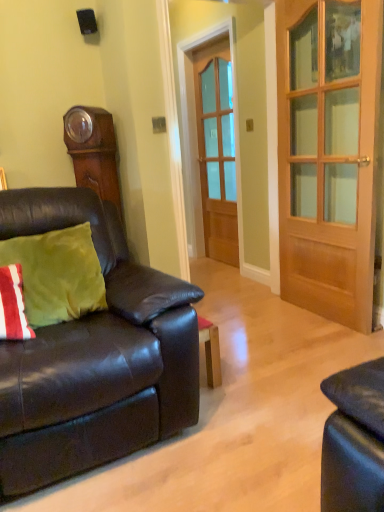
You are a GUI agent. You are given a task and a screenshot of the screen. Output one action in this format:
    pyautogui.click(x=<x>, y=<y>)
    Task: Click on the wooden grandfather clock at upper left
    
    Given the screenshot: What is the action you would take?
    pos(97,163)

Image resolution: width=384 pixels, height=512 pixels. What do you see at coordinates (97, 163) in the screenshot? I see `wooden grandfather clock at upper left` at bounding box center [97, 163].

Image resolution: width=384 pixels, height=512 pixels. Describe the element at coordinates (328, 154) in the screenshot. I see `wooden door at center, which is counted as the 2th door, starting from the left` at that location.

The image size is (384, 512). What do you see at coordinates (94, 357) in the screenshot?
I see `matte black couch at left` at bounding box center [94, 357].

This screenshot has height=512, width=384. I want to click on black matte speaker at upper center, so click(x=87, y=21).

This screenshot has height=512, width=384. Find the location of `wooden grandfather clock at upper left`. wooden grandfather clock at upper left is located at coordinates (97, 163).

Which object is positioned more to the right, wooden grandfather clock at upper left or wooden door at center, which is counted as the 2th door, starting from the left?

wooden door at center, which is counted as the 2th door, starting from the left.

Is wooden grandfather clock at upper left bigger or smaller than wooden door at center, which is counted as the 2th door, starting from the left?

wooden grandfather clock at upper left is smaller than wooden door at center, which is counted as the 2th door, starting from the left.

Is point (103, 170) behind point (319, 311)?

No, (103, 170) is closer to viewer.

Measure the distance between wooden grandfather clock at upper left and wooden door at center, which is the first door from front to back.

wooden grandfather clock at upper left and wooden door at center, which is the first door from front to back, are 4.24 feet apart.

From the image's perspective, is green velvet pillow at left located above or below wooden grandfather clock at upper left?

green velvet pillow at left is below wooden grandfather clock at upper left.

Between point (69, 253) and point (72, 148), which one is positioned behind?

Point (72, 148)

Locate an element on the screen. The width and height of the screenshot is (384, 512). pillow on the right of wooden grandfather clock at upper left is located at coordinates coord(57,274).

Is green velvet pillow at left closer to camera compared to wooden grandfather clock at upper left?

Yes, green velvet pillow at left is in front of wooden grandfather clock at upper left.

You are a GUI agent. You are given a task and a screenshot of the screen. Output one action in this format:
    pyautogui.click(x=<x>, y=<y>)
    Task: Click on the studio couch below the green velvet pillow at left (from the image's perspective)
    The height and width of the screenshot is (512, 384).
    Given the screenshot: What is the action you would take?
    pyautogui.click(x=94, y=357)

Between matte black couch at left and green velvet pillow at left, which one has more height?

With more height is matte black couch at left.

Considering the relative positions of matte black couch at left and green velvet pillow at left in the image provided, is matte black couch at left to the right of green velvet pillow at left from the viewer's perspective?

Yes.

Is point (52, 368) less distant than point (48, 255)?

That is True.

Is black matte speaker at upper center not close to wooden grandfather clock at upper left?

Actually, black matte speaker at upper center and wooden grandfather clock at upper left are a little close together.

Measure the distance between black matte speaker at upper center and wooden grandfather clock at upper left.

black matte speaker at upper center is 26.95 inches from wooden grandfather clock at upper left.

From the picture: Considering the relative sizes of black matte speaker at upper center and wooden grandfather clock at upper left in the image provided, is black matte speaker at upper center thinner than wooden grandfather clock at upper left?

Indeed, black matte speaker at upper center has a lesser width compared to wooden grandfather clock at upper left.

Between black matte speaker at upper center and wooden grandfather clock at upper left, which one has more height?

wooden grandfather clock at upper left is taller.

Considering the relative sizes of wooden door at center, which is counted as the 2th door, starting from the left, and matte black couch at left in the image provided, is wooden door at center, which is counted as the 2th door, starting from the left, taller than matte black couch at left?

Yes, wooden door at center, which is counted as the 2th door, starting from the left, is taller than matte black couch at left.

Identify the location of studio couch that appears below the wooden door at center, which is the first door from front to back (from the image's perspective). This screenshot has width=384, height=512. (94, 357).

Is wooden door at center, which is the first door from front to back, to the right of matte black couch at left from the viewer's perspective?

Yes, wooden door at center, which is the first door from front to back, is to the right of matte black couch at left.

Which object is closer to the camera taking this photo, wooden grandfather clock at upper left or green velvet pillow at left?

green velvet pillow at left is closer to the camera.

Is wooden grandfather clock at upper left not inside green velvet pillow at left?

Indeed, wooden grandfather clock at upper left is completely outside green velvet pillow at left.

Is wooden grandfather clock at upper left to the left of green velvet pillow at left from the viewer's perspective?

Yes.

How different are the orientations of matte black couch at left and wooden door at center, which is counted as the 2th door, starting from the left, in degrees?

There is a 91.3-degree angle between the facing directions of matte black couch at left and wooden door at center, which is counted as the 2th door, starting from the left.

Consider the image. Is matte black couch at left at the left side of wooden door at center, the 1th door viewed from the right?

Yes, matte black couch at left is to the left of wooden door at center, the 1th door viewed from the right.

Does matte black couch at left have a lesser width compared to wooden door at center, which is the first door from front to back?

No, matte black couch at left is not thinner than wooden door at center, which is the first door from front to back.

Between matte black couch at left and wooden door at center, the 2th door from the back, which one has smaller size?

With smaller size is wooden door at center, the 2th door from the back.

In the image, there is a wooden door at center, which is counted as the 2th door, starting from the left. Identify the location of cabinetry above it (from the image's perspective). (97, 163).

The height and width of the screenshot is (512, 384). In order to click on pillow below the wooden grandfather clock at upper left (from a real-world perspective) in this screenshot , I will do `click(57, 274)`.

When comparing their distances from green velvet pillow at left, does black matte speaker at upper center or wooden door at center, which appears as the first door when viewed from the left, seem further?

Among the two, wooden door at center, which appears as the first door when viewed from the left, is located further to green velvet pillow at left.

Estimate the real-world distances between objects in this image. Which object is closer to wooden door at center, placed as the 1th door when sorted from back to front, green velvet pillow at left or wooden door at center, the 2th door from the back?

wooden door at center, the 2th door from the back, lies closer to wooden door at center, placed as the 1th door when sorted from back to front, than the other object.

From the image, which object appears to be nearer to wooden door at center, which is counted as the 2th door, starting from the right, black matte speaker at upper center or wooden grandfather clock at upper left?

The object closer to wooden door at center, which is counted as the 2th door, starting from the right, is wooden grandfather clock at upper left.

Considering their positions, is black matte speaker at upper center positioned further to matte black couch at left than wooden door at center, which is the first door from front to back?

Based on the image, black matte speaker at upper center appears to be further to matte black couch at left.

Considering their positions, is wooden grandfather clock at upper left positioned closer to black matte speaker at upper center than matte black couch at left?

wooden grandfather clock at upper left is closer to black matte speaker at upper center.

Looking at the image, which one is located further to wooden door at center, placed as the 1th door when sorted from back to front, black matte speaker at upper center or wooden door at center, the 2th door from the back?

black matte speaker at upper center lies further to wooden door at center, placed as the 1th door when sorted from back to front, than the other object.

From the image, which object appears to be farther from black matte speaker at upper center, wooden door at center, which appears as the first door when viewed from the left, or green velvet pillow at left?

wooden door at center, which appears as the first door when viewed from the left, is positioned further to the anchor black matte speaker at upper center.

Based on their spatial positions, is wooden grandfather clock at upper left or green velvet pillow at left further from wooden door at center, the 1th door viewed from the right?

green velvet pillow at left lies further to wooden door at center, the 1th door viewed from the right, than the other object.

Image resolution: width=384 pixels, height=512 pixels. I want to click on loudspeaker between green velvet pillow at left and wooden door at center, which is counted as the 2th door, starting from the right, along the z-axis, so click(x=87, y=21).

Locate an element on the screen. This screenshot has width=384, height=512. studio couch between wooden grandfather clock at upper left and wooden door at center, which is the first door from front to back, from left to right is located at coordinates (94, 357).

Locate an element on the screen. cabinetry that lies between black matte speaker at upper center and green velvet pillow at left from top to bottom is located at coordinates (97, 163).

The width and height of the screenshot is (384, 512). Identify the location of pillow between black matte speaker at upper center and matte black couch at left from top to bottom. (57, 274).